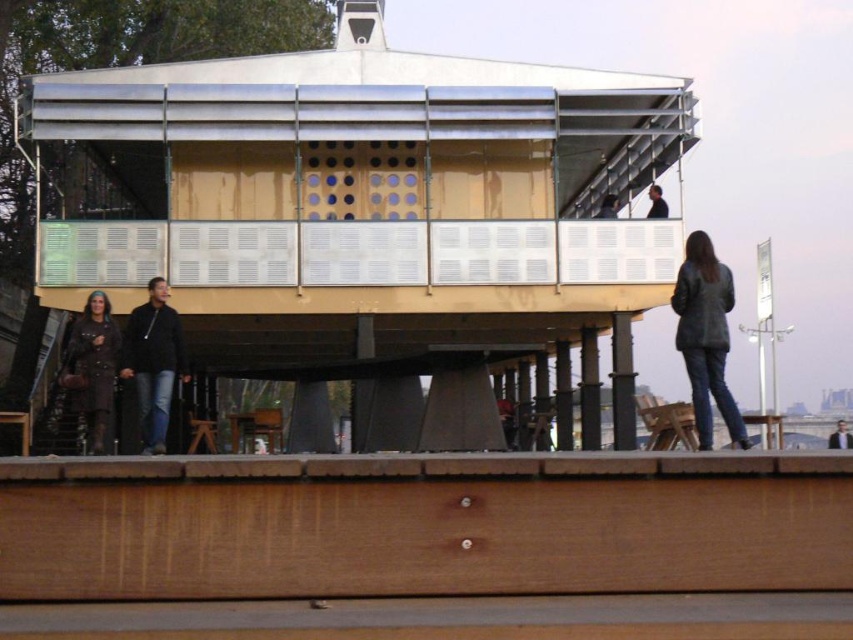
Question: Which object is closer to the camera taking this photo?

Choices:
 (A) dark gray leather jacket at upper right
 (B) black leather jacket at upper right

Answer: (B)

Question: Does brown leather coat at lower left appear over black leather jacket at upper right?

Choices:
 (A) yes
 (B) no

Answer: (B)

Question: Is dark gray leather jacket at upper right below dark brown leather jacket at upper center?

Choices:
 (A) yes
 (B) no

Answer: (A)

Question: Which object appears farthest from the camera in this image?

Choices:
 (A) dark gray leather jacket at upper right
 (B) dark brown leather jacket at upper center
 (C) black leather jacket at lower left

Answer: (A)

Question: Does black leather jacket at upper right have a larger size compared to dark brown leather jacket at upper center?

Choices:
 (A) yes
 (B) no

Answer: (A)

Question: Which object appears farthest from the camera in this image?

Choices:
 (A) black leather jacket at lower left
 (B) dark gray leather jacket at upper right

Answer: (B)